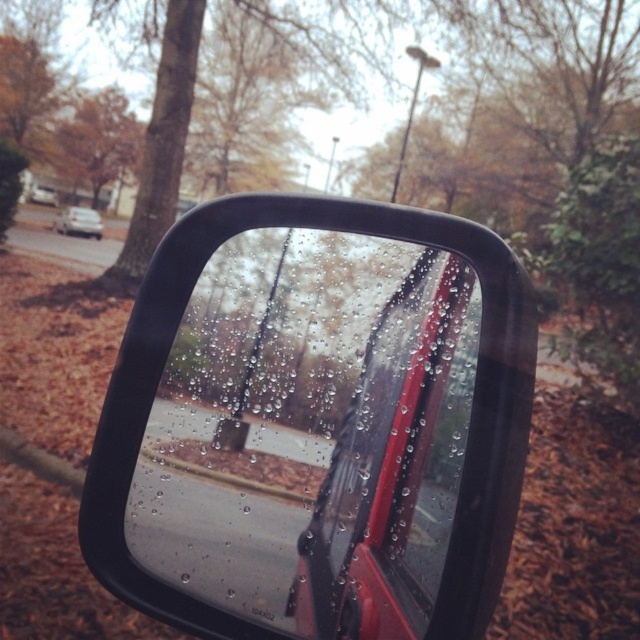
You are holding a camera and want to take a photo of the glossy plastic car mirror at center. If the camera can only focus on objects within 20 inches, will it be able to capture the mirror clearly?

The glossy plastic car mirror at center and camera are 21.83 inches apart from each other. Since the distance exceeds the camera focus range of 20 inches, the camera cannot capture the mirror clearly.

You are a delivery person trying to secure a package on the roof of the white matte sedan at left. You need to ensure that the glossy plastic car mirror at center won not be hit by the package. Based on the scene, can you determine if the mirror is large enough to avoid being struck by the package?

The glossy plastic car mirror at center is bigger than the white matte sedan at left, so the mirror is large enough to avoid being struck by the package placed on the roof of the white matte sedan at left.

You are a driver checking the side mirror of your car. You notice two points on the mirror at coordinates point [372,260] and point [93,220]. Which point is closer to you?

Point [372,260] is in front of point [93,220], so it is closer to you.